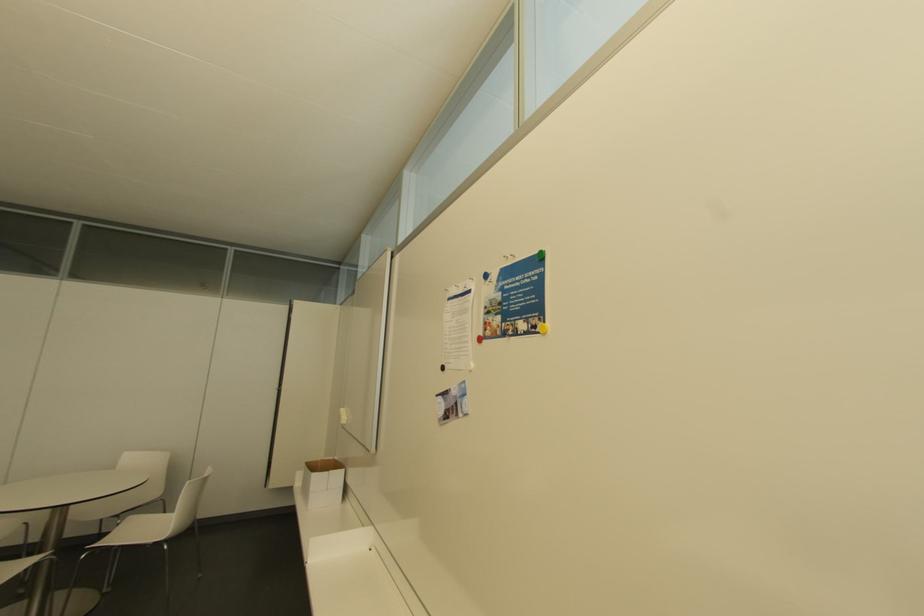
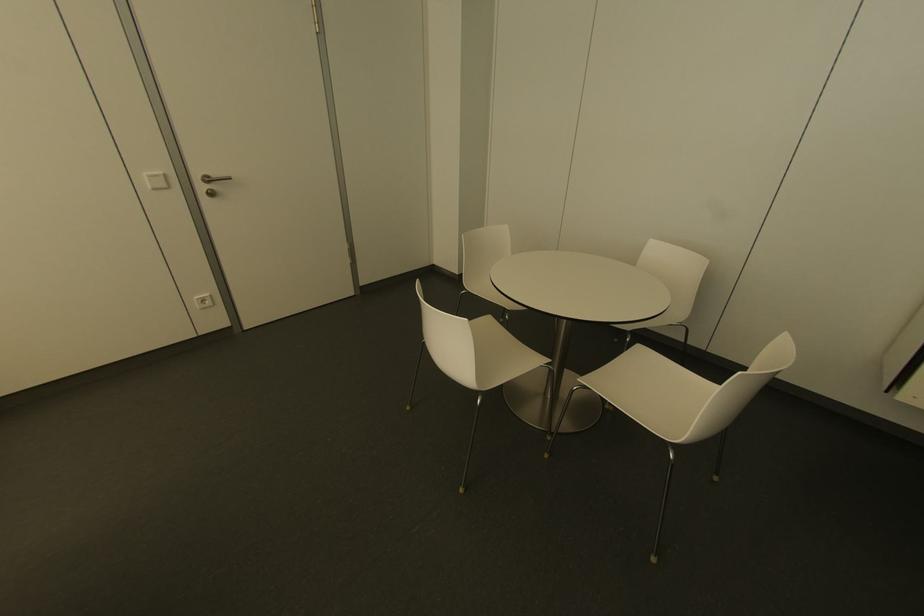
Find the pixel in the second image that matches (x=50, y=552) in the first image.

(546, 361)